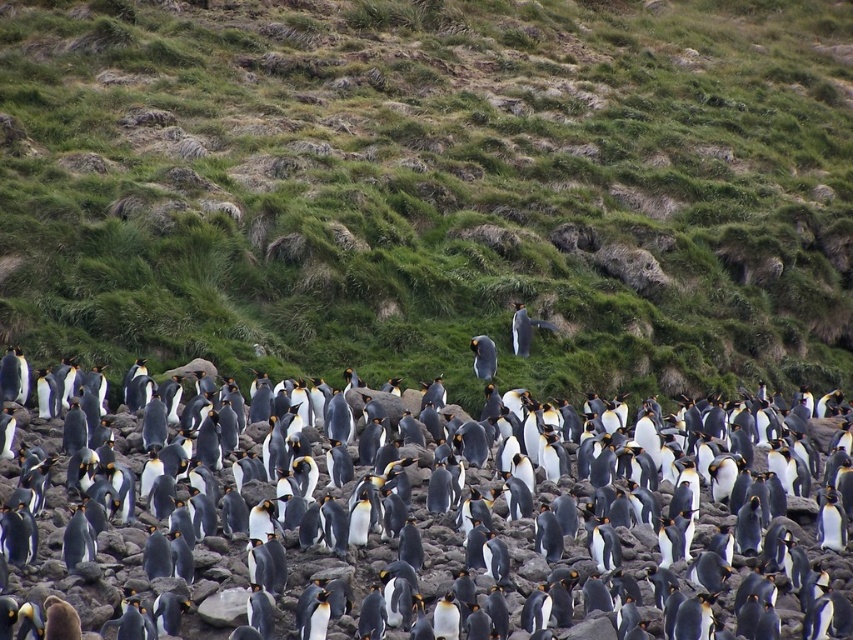
Which is behind, point (229, 627) or point (474, 364)?

Positioned behind is point (474, 364).

Does black matte penguin at center have a greater height compared to black glossy penguin at center?

No, black matte penguin at center is not taller than black glossy penguin at center.

Measure the distance between point (13, 536) and camera.

17.56 meters

Image resolution: width=853 pixels, height=640 pixels. In order to click on black matte penguin at center in this screenshot , I will do `click(418, 541)`.

Can you confirm if green grassy hillside at upper center is smaller than black matte penguin at center?

No, green grassy hillside at upper center is not smaller than black matte penguin at center.

Does green grassy hillside at upper center have a lesser width compared to black matte penguin at center?

No.

Between point (229, 104) and point (793, 512), which one is positioned in front?

Point (793, 512)

This screenshot has height=640, width=853. In order to click on green grassy hillside at upper center in this screenshot , I will do `click(432, 188)`.

Does black matte penguin at center have a lesser height compared to white fluffy penguin at center?

Correct, black matte penguin at center is not as tall as white fluffy penguin at center.

Is point (630, 444) more distant than point (518, 326)?

No.

Find the location of `black matte penguin at center`. black matte penguin at center is located at coordinates (418, 541).